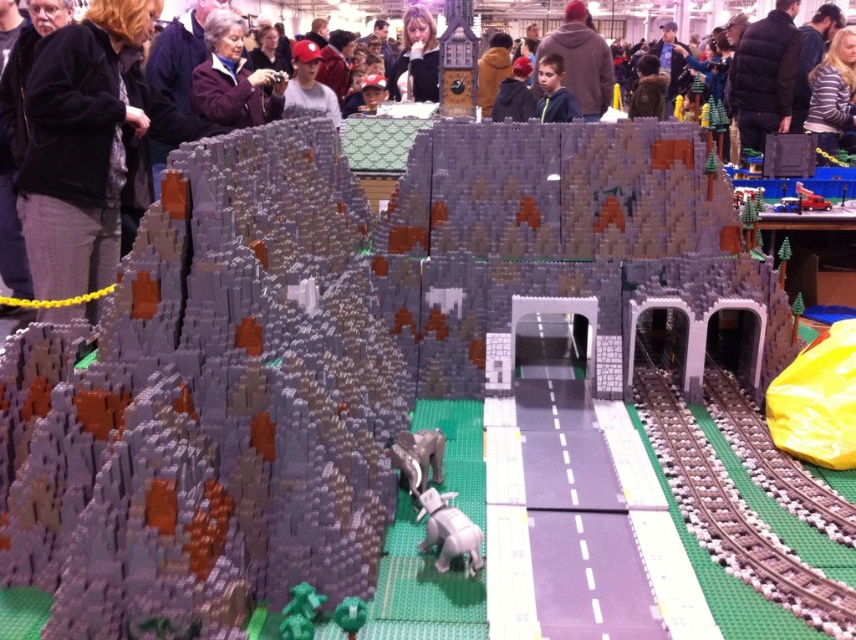
You are a visitor at the LEGO exhibition and you see the matte purple jacket at upper left and the green matte tree at lower center in the scene. Which object is positioned higher up in the image?

The matte purple jacket at upper left is positioned above the green matte tree at lower center, so it is higher up in the image.

You are a LEGO enthusiast who wants to place a new LEGO train on the scene. Where exactly should you place the train to align it with the existing brown metallic train track at right?

You should place the train at point (730, 509), where the brown metallic train track at right is located.